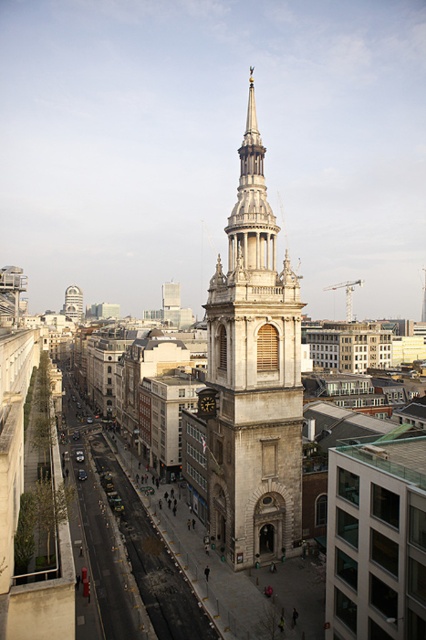
You are standing at point (253,378) in the city. What is the closest major structure to you?

The closest major structure to you at point (253,378) is the stone tower at center.

You are a tourist standing in front of the cityscape. You see the stone tower at center and the stone clock tower at center. Which one is directly above the other?

The stone tower at center is positioned under the stone clock tower at center, so the stone clock tower at center is directly above the stone tower at center.

You are a city planner assessing the central area. You notice the stone tower at center and the stone clock tower at center. Which one has a smaller width according to the city records?

The stone tower at center has a smaller width than the stone clock tower at center according to the city records.